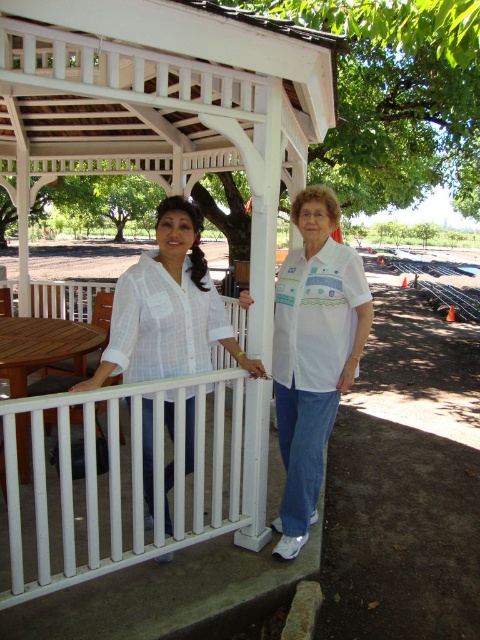
You are standing at the point marked as point (313, 353) in the image. What object is located exactly at that point?

The white cotton shirt at center is located exactly at point (313, 353).

You are a photographer planning to take a group photo of the two people in the image. The white cotton shirt at center and the white woven blouse at center are both in the frame. Since you want to ensure that both subjects are visible from head to toe, which one should you adjust the camera angle to focus on first?

The white cotton shirt at center is much taller than the white woven blouse at center, so you should adjust the camera angle to focus on the white cotton shirt at center first to ensure both are visible from head to toe.

You are a photographer setting up a shoot in the park. You need to position two models wearing the white cotton shirt at center and white woven blouse at center so that their clothing sizes are proportionate to their body sizes. Which model should wear the smaller garment?

The white cotton shirt at center has a smaller size compared to the white woven blouse at center, so the model wearing the white cotton shirt at center should be the one with the smaller body size to maintain proportionate sizing.